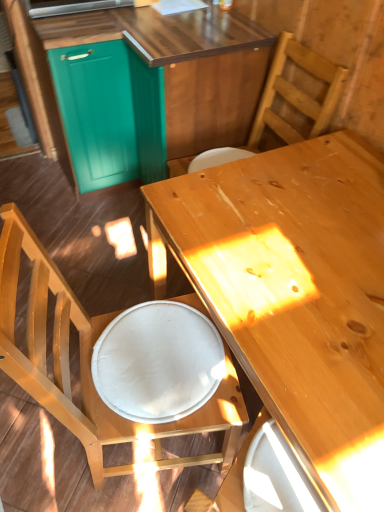
Question: Does light brown wood desk at center appear on the right side of teal wood cabinetry at upper left?

Choices:
 (A) yes
 (B) no

Answer: (A)

Question: Is teal wood cabinetry at upper left a part of light brown wood desk at center?

Choices:
 (A) no
 (B) yes

Answer: (A)

Question: From a real-world perspective, is light brown wood desk at center on top of teal wood cabinetry at upper left?

Choices:
 (A) yes
 (B) no

Answer: (B)

Question: From the image's perspective, is light brown wood desk at center beneath teal wood cabinetry at upper left?

Choices:
 (A) yes
 (B) no

Answer: (A)

Question: Is light brown wood desk at center positioned far away from teal wood cabinetry at upper left?

Choices:
 (A) yes
 (B) no

Answer: (B)

Question: Based on their positions, is light brown wood desk at center located to the left or right of white fabric plate at lower center?

Choices:
 (A) right
 (B) left

Answer: (A)

Question: Would you say light brown wood desk at center is inside or outside white fabric plate at lower center?

Choices:
 (A) outside
 (B) inside

Answer: (A)

Question: In terms of size, does light brown wood desk at center appear bigger or smaller than white fabric plate at lower center?

Choices:
 (A) big
 (B) small

Answer: (A)

Question: From a real-world perspective, is light brown wood desk at center above or below white fabric plate at lower center?

Choices:
 (A) above
 (B) below

Answer: (B)

Question: Visually, is wooden chair at upper right, which is the 1th chair in top-to-bottom order, positioned to the left or to the right of white fabric plate at lower center?

Choices:
 (A) left
 (B) right

Answer: (B)

Question: From a real-world perspective, is wooden chair at upper right, which is the 1th chair in top-to-bottom order, positioned above or below white fabric plate at lower center?

Choices:
 (A) above
 (B) below

Answer: (A)

Question: In the image, is wooden chair at upper right, which is the 1th chair in top-to-bottom order, positioned in front of or behind white fabric plate at lower center?

Choices:
 (A) front
 (B) behind

Answer: (B)

Question: Looking at the image, does wooden chair at upper right, which is the second chair in bottom-to-top order, seem bigger or smaller compared to white fabric plate at lower center?

Choices:
 (A) small
 (B) big

Answer: (B)

Question: Visually, is teal wood cabinetry at upper left positioned to the left or to the right of light brown wood desk at center?

Choices:
 (A) right
 (B) left

Answer: (B)

Question: Is teal wood cabinetry at upper left inside the boundaries of light brown wood desk at center, or outside?

Choices:
 (A) outside
 (B) inside

Answer: (A)